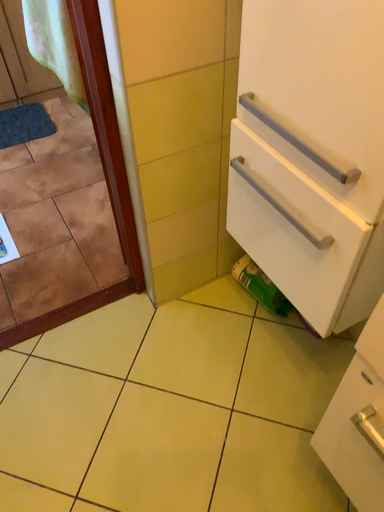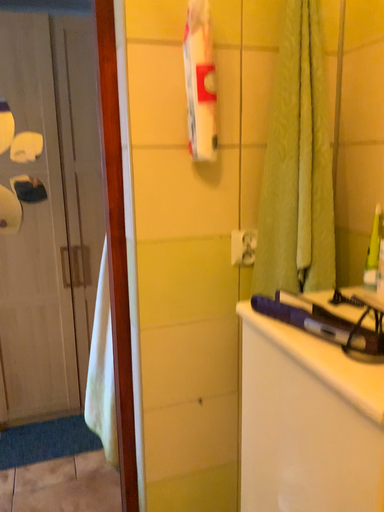
Question: Which way did the camera rotate in the video?

Choices:
 (A) rotated right
 (B) rotated left

Answer: (B)